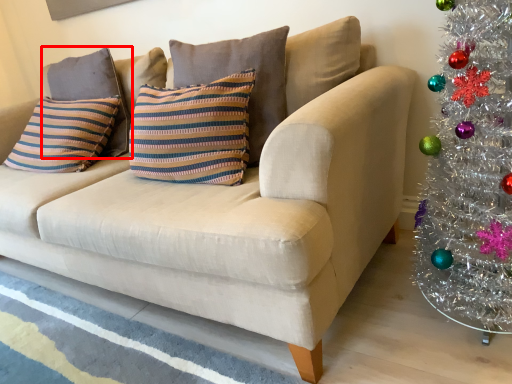
Question: From the image's perspective, considering the relative positions of pillow (annotated by the red box) and pillow in the image provided, where is pillow (annotated by the red box) located with respect to the staircase?

Choices:
 (A) below
 (B) above

Answer: (B)